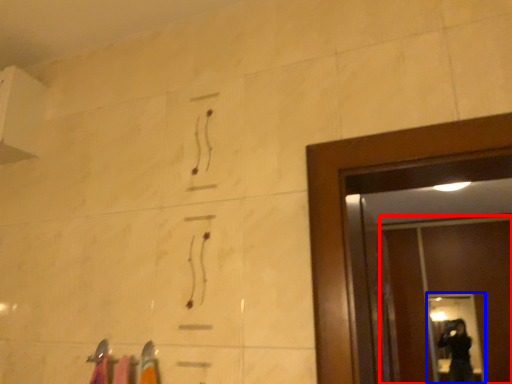
Question: Which object is further to the camera taking this photo, screen door (highlighted by a red box) or glass door (highlighted by a blue box)?

Choices:
 (A) screen door
 (B) glass door

Answer: (B)